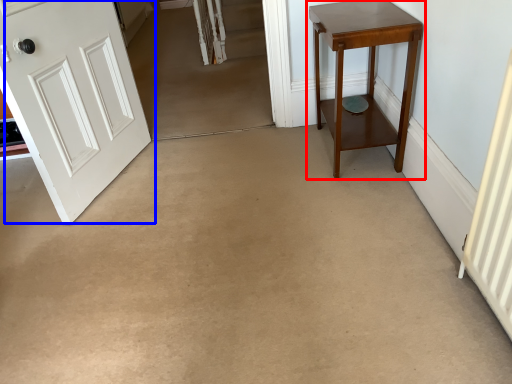
Question: Which of the following is the farthest to the observer, table (highlighted by a red box) or door (highlighted by a blue box)?

Choices:
 (A) table
 (B) door

Answer: (A)